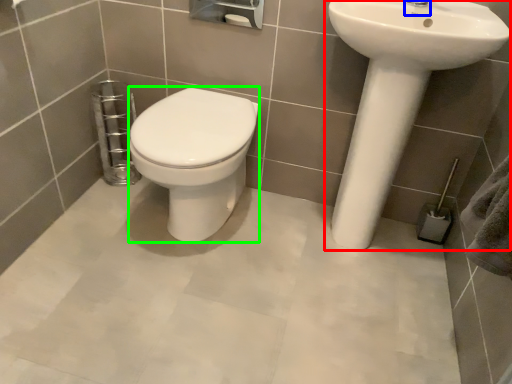
Question: Which object is the closest to the sink (highlighted by a red box)? Choose among these: plumbing fixture (highlighted by a blue box) or bidet (highlighted by a green box).

Choices:
 (A) plumbing fixture
 (B) bidet

Answer: (A)